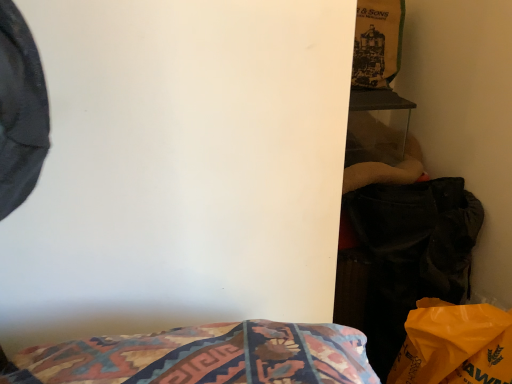
Describe the element at coordinates (455, 345) in the screenshot. I see `orange plastic bag at lower right` at that location.

In order to face orange plastic bag at lower right, should I rotate leftwards or rightwards?

Rotate right and turn 23.820 degrees.

Where is `orange plastic bag at lower right`? orange plastic bag at lower right is located at coordinates (455, 345).

At what (x,y) coordinates should I click in order to perform the action: click on orange plastic bag at lower right. Please return your answer as a coordinate pair (x, y). Looking at the image, I should click on (455, 345).